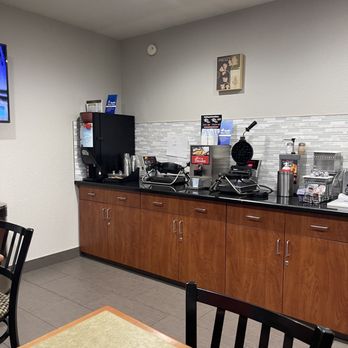
In order to click on tiled backsplash in this screenshot , I will do `click(307, 130)`.